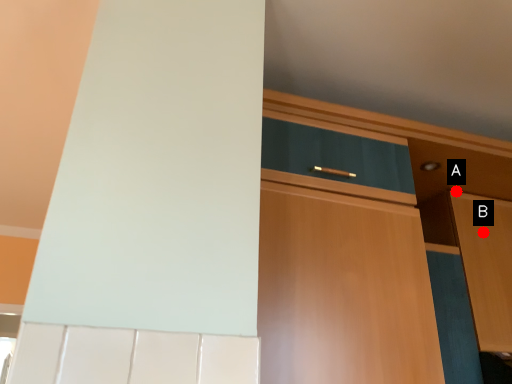
Question: Two points are circled on the image, labeled by A and B beside each circle. Which point is closer to the camera?

Choices:
 (A) A is closer
 (B) B is closer

Answer: (B)